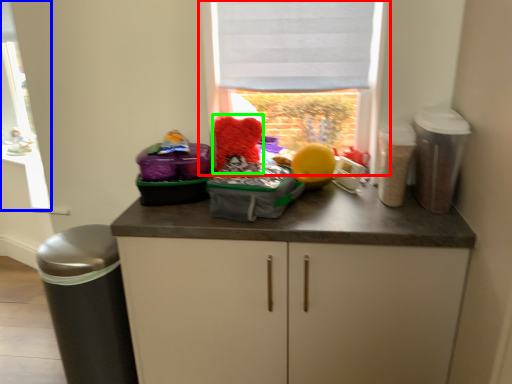
Question: Which object is positioned closest to window (highlighted by a red box)? Select from window frame (highlighted by a blue box) and teddy (highlighted by a green box).

Choices:
 (A) window frame
 (B) teddy

Answer: (B)